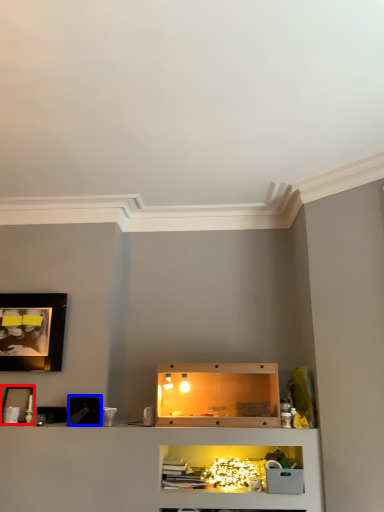
Question: Which point is closer to the camera, picture frame (highlighted by a red box) or picture frame (highlighted by a blue box)?

Choices:
 (A) picture frame
 (B) picture frame

Answer: (B)